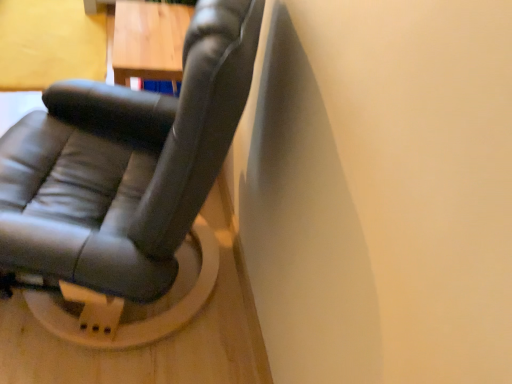
Question: Does matte black chair at center turn towards wooden table at upper left?

Choices:
 (A) yes
 (B) no

Answer: (B)

Question: From a real-world perspective, is matte black chair at center located beneath wooden table at upper left?

Choices:
 (A) yes
 (B) no

Answer: (A)

Question: Is matte black chair at center next to wooden table at upper left and touching it?

Choices:
 (A) no
 (B) yes

Answer: (A)

Question: Is the position of matte black chair at center more distant than that of wooden table at upper left?

Choices:
 (A) no
 (B) yes

Answer: (A)

Question: From a real-world perspective, is matte black chair at center physically above wooden table at upper left?

Choices:
 (A) no
 (B) yes

Answer: (A)

Question: Considering the relative sizes of matte black chair at center and wooden table at upper left in the image provided, is matte black chair at center taller than wooden table at upper left?

Choices:
 (A) yes
 (B) no

Answer: (B)

Question: Considering the relative sizes of wooden table at upper left and matte black chair at center in the image provided, is wooden table at upper left taller than matte black chair at center?

Choices:
 (A) no
 (B) yes

Answer: (B)

Question: Is wooden table at upper left at the left side of matte black chair at center?

Choices:
 (A) yes
 (B) no

Answer: (B)

Question: Considering the relative positions of wooden table at upper left and matte black chair at center in the image provided, is wooden table at upper left behind matte black chair at center?

Choices:
 (A) no
 (B) yes

Answer: (B)

Question: From a real-world perspective, is wooden table at upper left over matte black chair at center?

Choices:
 (A) no
 (B) yes

Answer: (B)

Question: Is wooden table at upper left placed right next to matte black chair at center?

Choices:
 (A) no
 (B) yes

Answer: (A)

Question: Is wooden table at upper left facing away from matte black chair at center?

Choices:
 (A) no
 (B) yes

Answer: (A)

Question: Considering the relative positions of wooden table at upper left and matte black chair at center in the image provided, is wooden table at upper left to the left or to the right of matte black chair at center?

Choices:
 (A) left
 (B) right

Answer: (B)